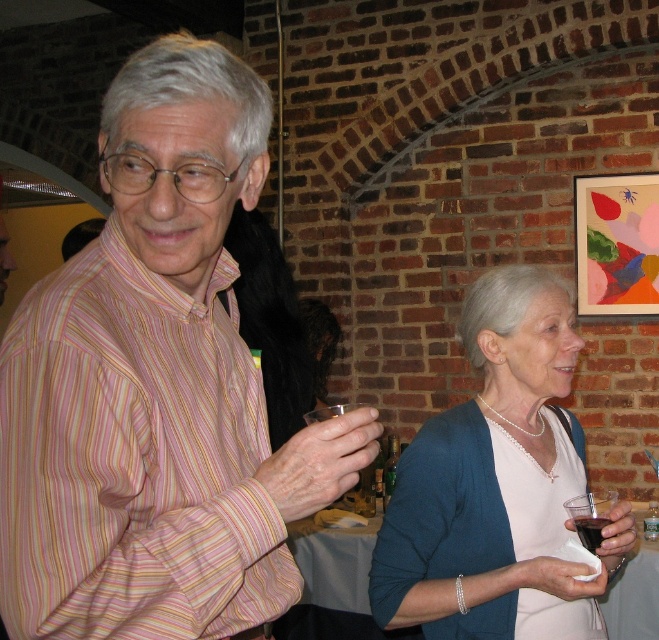
Question: Can you confirm if transparent plastic cup at lower center is thinner than dark red glass at lower right?

Choices:
 (A) no
 (B) yes

Answer: (A)

Question: Can you confirm if pearl necklace at upper right is positioned above dark red glass at lower right?

Choices:
 (A) no
 (B) yes

Answer: (B)

Question: Does pink striped shirt at left come behind pearl necklace at upper right?

Choices:
 (A) no
 (B) yes

Answer: (A)

Question: Which point is farther to the camera?

Choices:
 (A) (590, 547)
 (B) (316, 417)
 (C) (467, 484)
 (D) (175, 532)

Answer: (C)

Question: Among these objects, which one is farthest from the camera?

Choices:
 (A) pink striped shirt at left
 (B) pearl necklace at upper right
 (C) transparent plastic cup at lower right
 (D) dark red glass at lower right

Answer: (D)

Question: Estimate the real-world distances between objects in this image. Which object is farther from the transparent plastic cup at lower center?

Choices:
 (A) pearl necklace at upper right
 (B) pink striped shirt at left

Answer: (B)